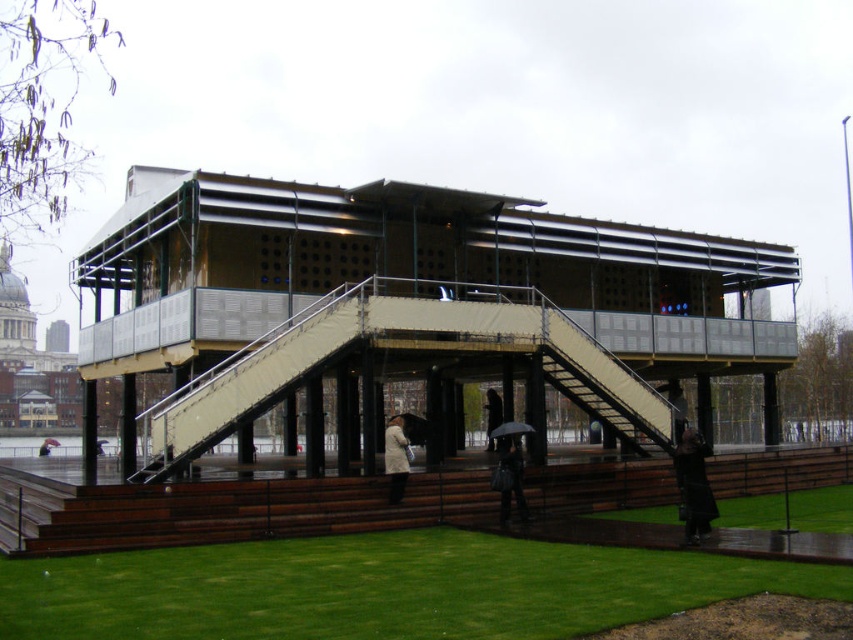
You are planning to host a small outdoor event and need to place a 2x3 meter tent. Given the green lawn at lower center and the light beige fabric coat at center, which area can accommodate the tent without overlapping any objects?

The green lawn at lower center is bigger than the light beige fabric coat at center, so the tent can be placed on the green lawn at lower center as it has more space.

Based on the photo, you are planning to host a small event in the park and need to place a 2.5 meter wide tent. You see the green lawn at lower center and the light beige fabric coat at center. Which area can accommodate the tent without exceeding its width?

The green lawn at lower center has a larger width than the light beige fabric coat at center, so the tent can be placed on the green lawn at lower center as it has sufficient width to accommodate the 2.5 meter wide tent.